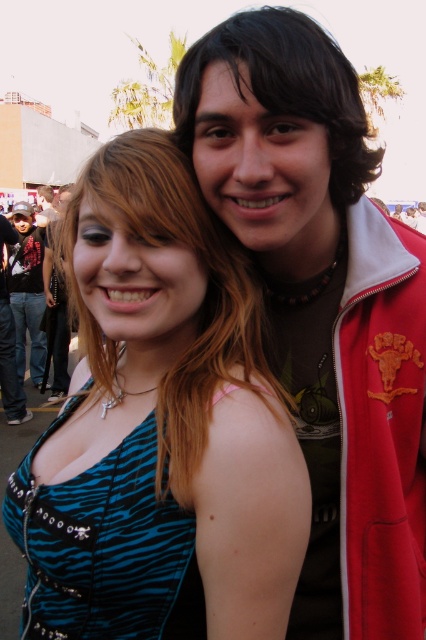
Can you confirm if zebra print fabric dress at center is shorter than brushed metal jacket at left?

Yes, zebra print fabric dress at center is shorter than brushed metal jacket at left.

Between point (180, 618) and point (42, 234), which one is positioned in front?

Point (180, 618) is in front.

At what (x,y) coordinates should I click in order to perform the action: click on zebra print fabric dress at center. Please return your answer as a coordinate pair (x, y). The image size is (426, 640). Looking at the image, I should click on (104, 548).

Who is shorter, zebra print dress at center or zebra print fabric dress at center?

With less height is zebra print fabric dress at center.

Who is positioned more to the left, zebra print dress at center or zebra print fabric dress at center?

zebra print fabric dress at center is more to the left.

Which is in front, point (416, 552) or point (85, 532)?

Point (85, 532)

You are a GUI agent. You are given a task and a screenshot of the screen. Output one action in this format:
    pyautogui.click(x=<x>, y=<y>)
    Task: Click on the zebra print dress at center
    This screenshot has width=426, height=640.
    Given the screenshot: What is the action you would take?
    pyautogui.click(x=322, y=304)

Who is more forward, (241, 22) or (26, 248)?

Point (241, 22) is in front.

Which is in front, point (259, 28) or point (32, 349)?

Point (259, 28) is more forward.

Where is `matte brown hair at upper center`? This screenshot has height=640, width=426. matte brown hair at upper center is located at coordinates pos(285,88).